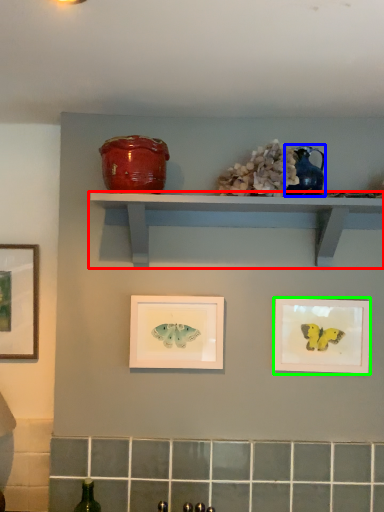
Question: Which object is the closest to the shelf (highlighted by a red box)? Choose among these: teal (highlighted by a blue box) or picture frame (highlighted by a green box).

Choices:
 (A) teal
 (B) picture frame

Answer: (A)